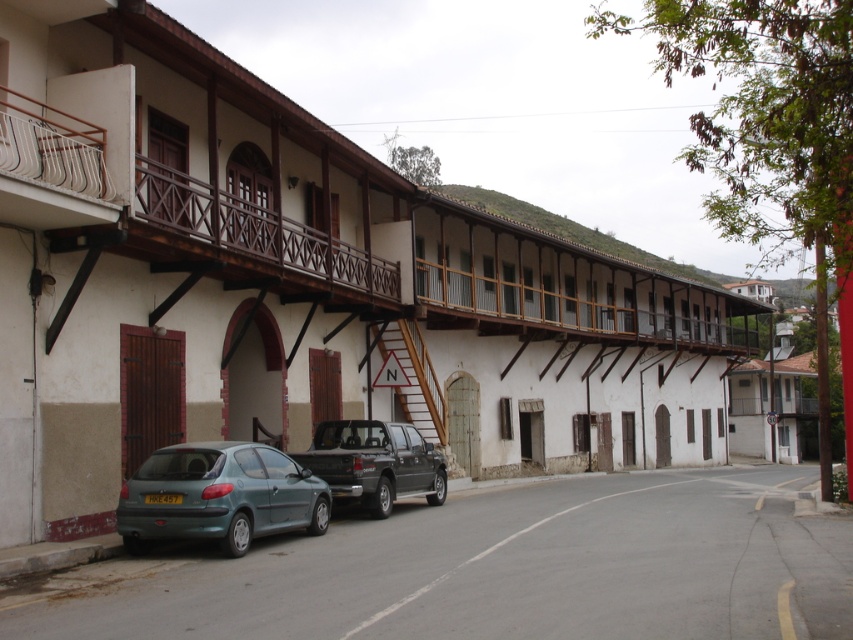
Does dark gray matte truck at center appear under wooden staircase at center?

Yes, dark gray matte truck at center is below wooden staircase at center.

Between dark gray matte truck at center and wooden staircase at center, which one appears on the left side from the viewer's perspective?

dark gray matte truck at center is more to the left.

Between point (392, 433) and point (392, 326), which one is positioned in front?

Point (392, 433)

This screenshot has height=640, width=853. Identify the location of dark gray matte truck at center. (375, 461).

Does white wooden balcony at upper left have a lesser height compared to wooden staircase at center?

Yes.

Describe the element at coordinates (51, 166) in the screenshot. I see `white wooden balcony at upper left` at that location.

Where is `white wooden balcony at upper left`? white wooden balcony at upper left is located at coordinates (51, 166).

Does teal matte hatchback at lower left appear over dark gray matte truck at center?

Indeed, teal matte hatchback at lower left is positioned over dark gray matte truck at center.

Is point (309, 474) in front of point (344, 492)?

Yes, point (309, 474) is closer to viewer.

Is point (144, 465) positioned before point (403, 484)?

Yes, point (144, 465) is in front of point (403, 484).

Where is `teal matte hatchback at lower left`? teal matte hatchback at lower left is located at coordinates (219, 496).